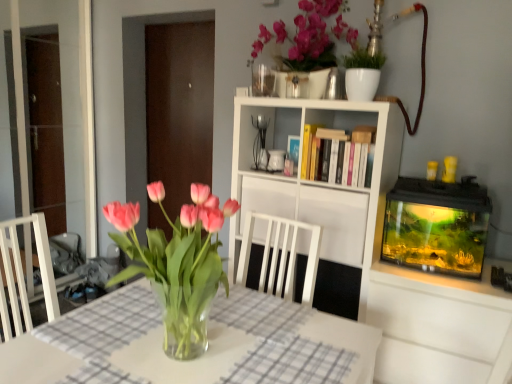
Where is `empty space that is ontop of clear glass vase at center (from a real-world perspective)`? Image resolution: width=512 pixels, height=384 pixels. empty space that is ontop of clear glass vase at center (from a real-world perspective) is located at coordinates (189, 344).